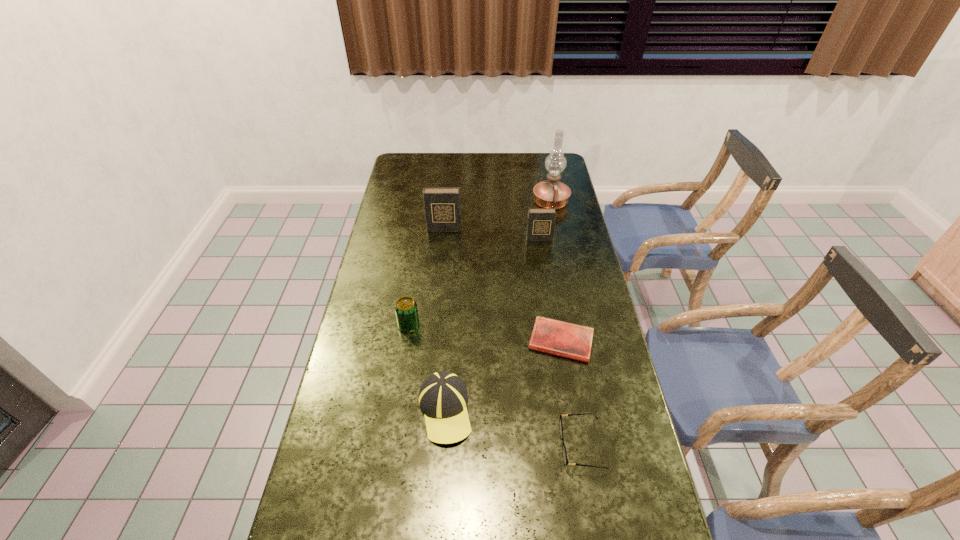
Identify which diary is the nearest to the second nearest diary. Please provide its 2D coordinates. Your answer should be formatted as a tuple, i.e. [(x, y)], where the tuple contains the x and y coordinates of a point satisfying the conditions above.

[(442, 205)]